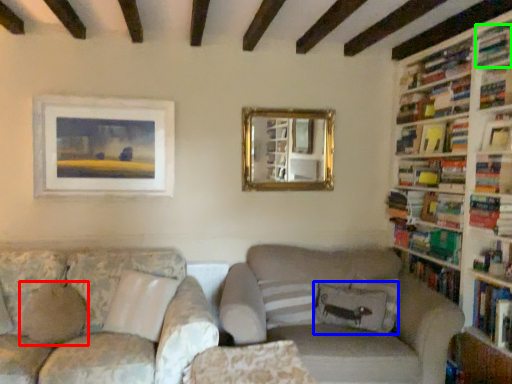
Question: Which object is positioned farthest from pillow (highlighted by a red box)? Select from pillow (highlighted by a blue box) and book (highlighted by a green box).

Choices:
 (A) pillow
 (B) book

Answer: (B)